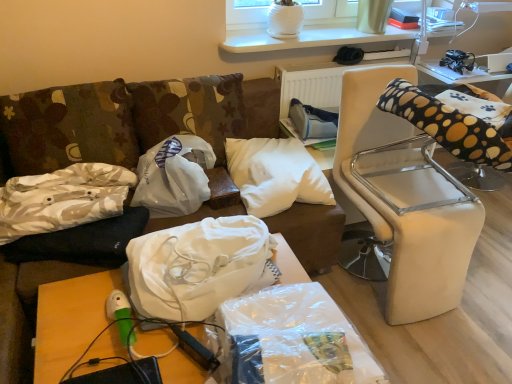
Find the location of `empty space that is ontop of wooden table at lower left, which is counted as the first table, starting from the left (from a real-world perspective)`. empty space that is ontop of wooden table at lower left, which is counted as the first table, starting from the left (from a real-world perspective) is located at coordinates (135, 336).